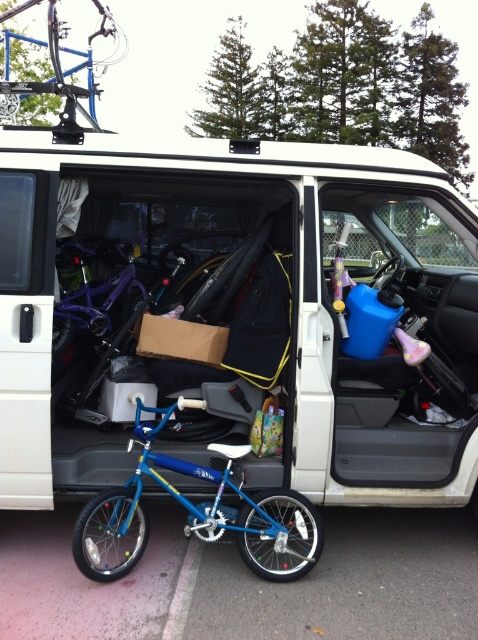
Question: Observing the image, what is the correct spatial positioning of white matte van at center in reference to shiny purple bicycle at center?

Choices:
 (A) right
 (B) left

Answer: (A)

Question: Is white matte van at center to the left of blue matte bicycle at center from the viewer's perspective?

Choices:
 (A) yes
 (B) no

Answer: (B)

Question: Estimate the real-world distances between objects in this image. Which object is closer to the blue matte bicycle at center?

Choices:
 (A) shiny purple bicycle at center
 (B) white matte van at center

Answer: (B)

Question: Does white matte van at center appear on the right side of shiny purple bicycle at center?

Choices:
 (A) no
 (B) yes

Answer: (B)

Question: Which of the following is the farthest from the observer?

Choices:
 (A) white matte van at center
 (B) shiny purple bicycle at center

Answer: (B)

Question: Which is farther from the white matte van at center?

Choices:
 (A) shiny purple bicycle at center
 (B) blue matte bicycle at center

Answer: (A)